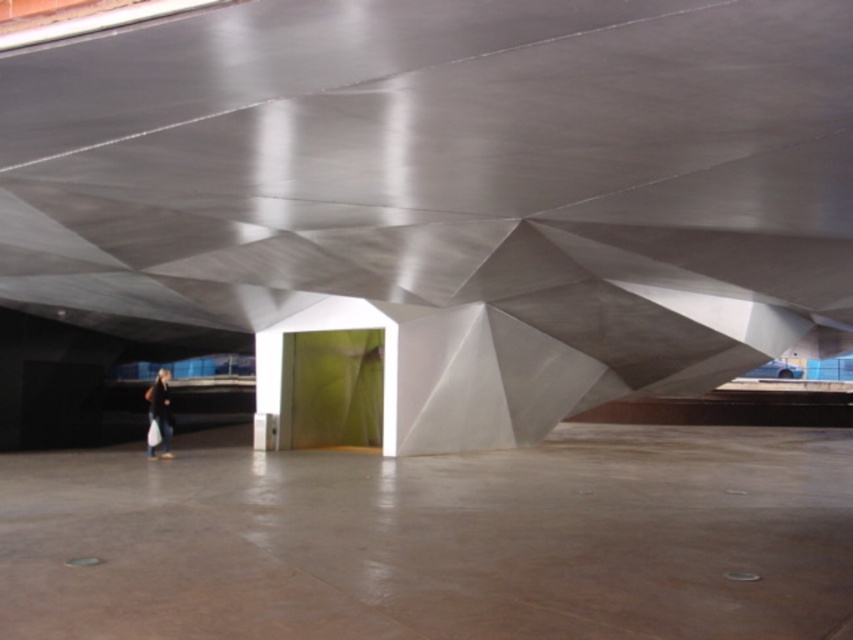
You are standing in the room and want to move from the dark blue jeans at lower left to the metallic silver structure at center. Which direction should you move to reach it?

You should move to your right since the metallic silver structure at center is located to the right of the dark blue jeans at lower left.

You are standing in the center of the room and want to walk to the rectangular opening in the wall. According to the coordinates provided, is the smooth concrete floor at center directly under your feet?

Yes, the smooth concrete floor at center is located at point coordinates of (437, 540), which is directly under your feet as you stand in the center of the room.

You are standing in the modern interior space and want to place the dark blue jeans at lower left on the smooth concrete floor at center. Will the jeans fit entirely on the floor without hanging off the edges?

The smooth concrete floor at center is wider than the dark blue jeans at lower left, so the jeans will fit entirely on the floor without any part hanging off the edges.